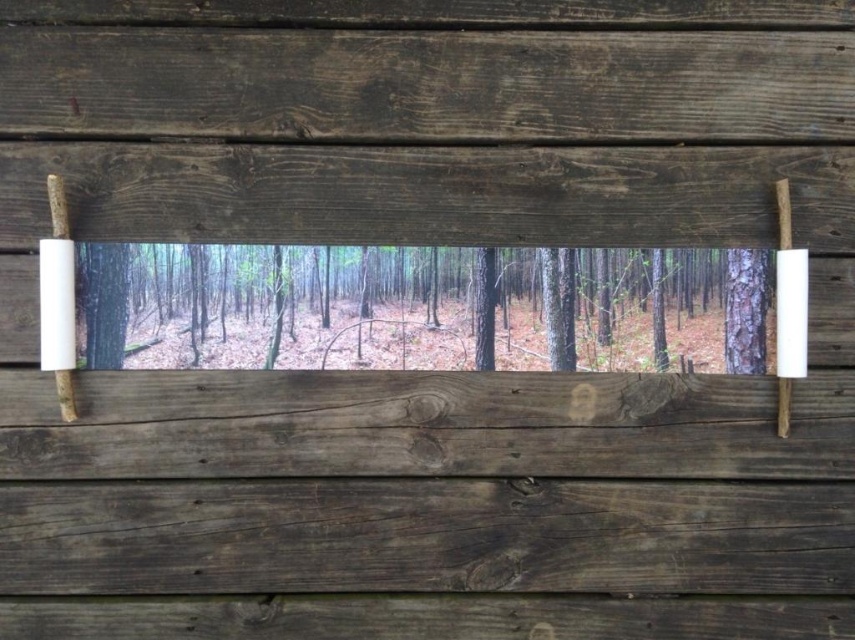
Question: Which object is positioned closest to the green matte tree at center?

Choices:
 (A) dark brown wood at center
 (B) dark wood plank at center
 (C) smooth brown tree trunk at right

Answer: (B)

Question: Does dark wood plank at center appear under green matte tree at center?

Choices:
 (A) yes
 (B) no

Answer: (A)

Question: Can you confirm if dark brown wood at center is bigger than green matte tree at center?

Choices:
 (A) no
 (B) yes

Answer: (B)

Question: Is green matte tree at center positioned at the back of smooth brown tree trunk at right?

Choices:
 (A) no
 (B) yes

Answer: (A)

Question: Based on their relative distances, which object is nearer to the smooth brown tree trunk at right?

Choices:
 (A) green matte tree at center
 (B) dark brown wood at center

Answer: (A)

Question: Among these objects, which one is farthest from the camera?

Choices:
 (A) green matte tree at center
 (B) dark brown wood at center
 (C) smooth brown tree trunk at right
 (D) dark wood plank at center

Answer: (C)